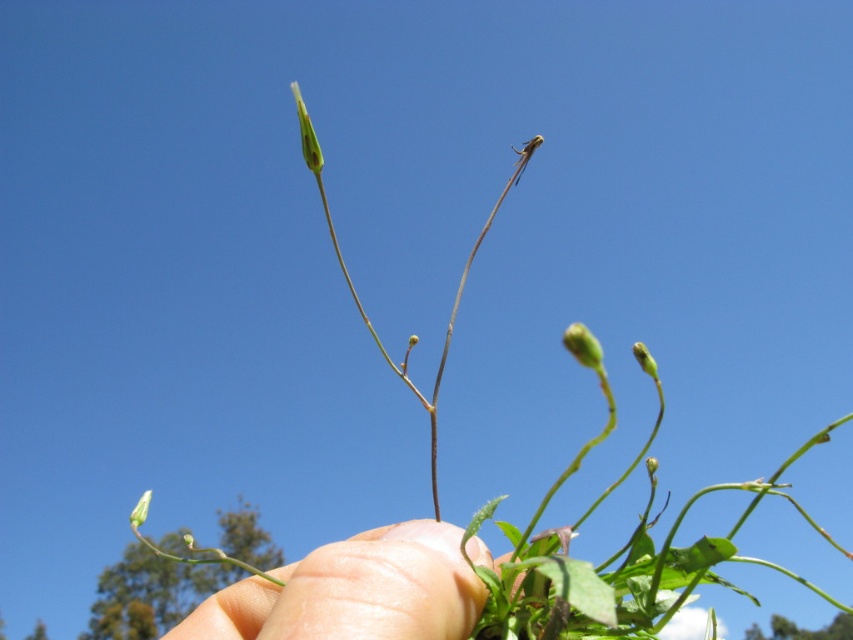
You are holding the plant and want to place it in a pot. The pot has two holes at the points labeled point [654,380] and point [142,512]. Which hole should you use to ensure the plant is closer to the camera after planting?

Point [654,380] is closer to the camera than point [142,512], so you should use the hole at point [654,380] to ensure the plant is closer to the camera after planting.

You are a botanist examining the plant in the image. You need to locate the green matte bud at upper center precisely. What are its coordinates?

The green matte bud at upper center is located at coordinates point (643,358).

You are holding a small plant with two green parts, a green matte bud at center and a green matte flower at upper center. Which one is located more to the right?

The green matte bud at center is more to the right than the green matte flower at upper center.